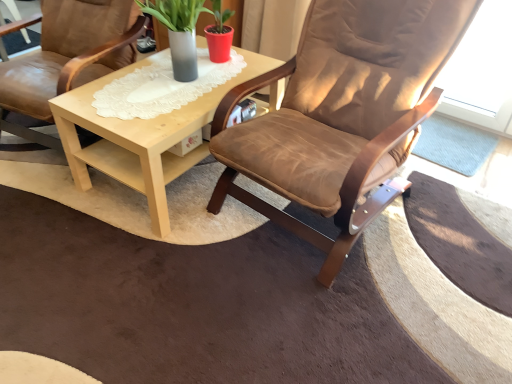
The width and height of the screenshot is (512, 384). I want to click on vacant area that is in front of matte gray vase at center, so click(156, 102).